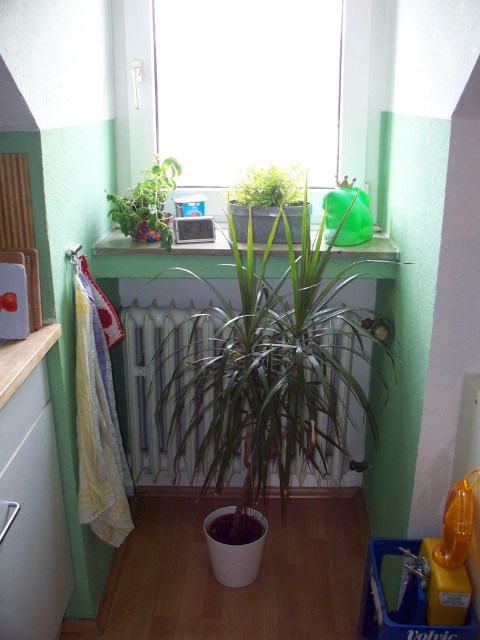
Question: Is green leafy plant at center wider than transparent glass window at upper center?

Choices:
 (A) yes
 (B) no

Answer: (A)

Question: Is transparent glass window at upper center bigger than green plastic container at upper center?

Choices:
 (A) yes
 (B) no

Answer: (A)

Question: Which object appears closest to the camera in this image?

Choices:
 (A) green leafy plant at upper center
 (B) green leafy plant at center
 (C) green matte plant at upper center
 (D) green plastic container at upper center

Answer: (B)

Question: Estimate the real-world distances between objects in this image. Which object is farther from the green plastic container at upper center?

Choices:
 (A) white metallic radiator at center
 (B) green leafy plant at center
 (C) green matte plant at upper center

Answer: (A)

Question: Is white metallic radiator at center closer to camera compared to green leafy plant at upper center?

Choices:
 (A) yes
 (B) no

Answer: (A)

Question: Which point is closer to the camera taking this photo?

Choices:
 (A) (153, 464)
 (B) (159, 134)

Answer: (B)